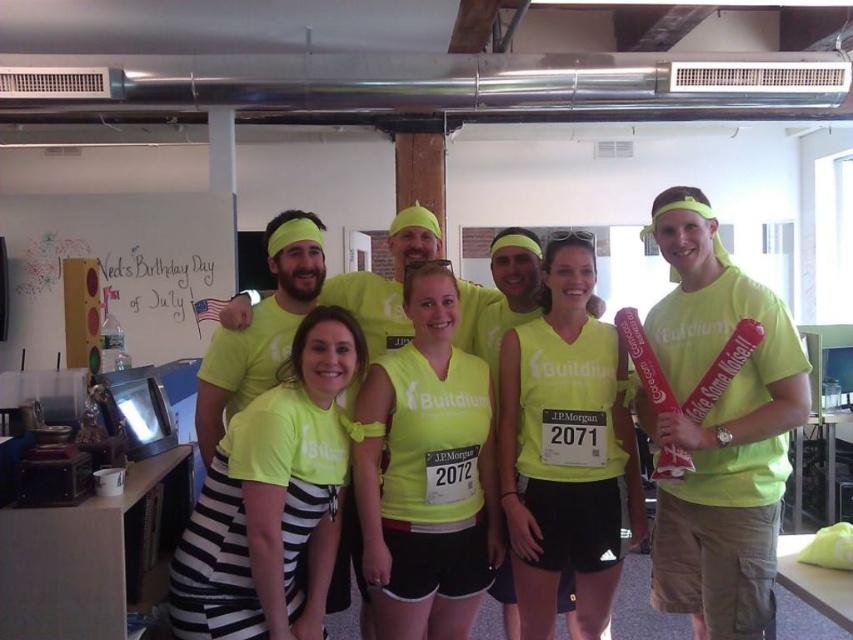
Question: Does matte neon yellow t-shirt at center appear under neon yellow jersey at center?

Choices:
 (A) yes
 (B) no

Answer: (B)

Question: Is neon yellow jersey at center to the left of matte yellow shirt at center from the viewer's perspective?

Choices:
 (A) no
 (B) yes

Answer: (A)

Question: Which is farther from the matte yellow shirt at center?

Choices:
 (A) matte neon yellow t-shirt at center
 (B) neon yellow t-shirt at center
 (C) neon yellow shirt at center

Answer: (A)

Question: Can you confirm if matte neon yellow t-shirt at center is smaller than neon yellow jersey at center?

Choices:
 (A) no
 (B) yes

Answer: (A)

Question: Which point is closer to the camera?

Choices:
 (A) (328, 452)
 (B) (432, 419)
 (C) (165, 291)

Answer: (A)

Question: Which point is closer to the camera taking this photo?

Choices:
 (A) (401, 248)
 (B) (799, 387)
 (C) (42, 337)

Answer: (B)